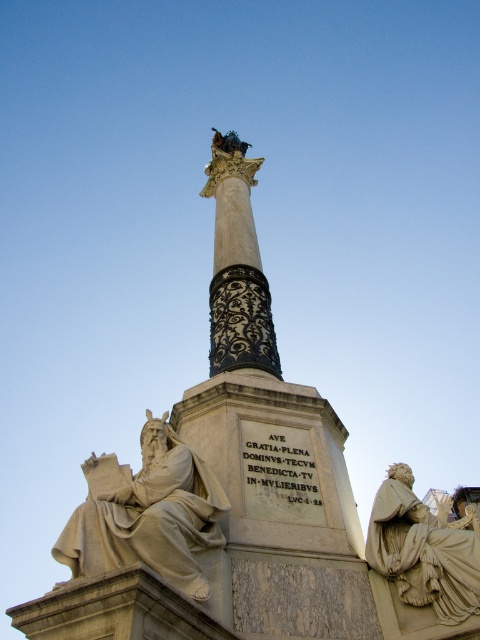
Between white marble statue at lower left and beige stone statue at lower right, which one is positioned lower?

white marble statue at lower left

Does white marble statue at lower left have a smaller size compared to beige stone statue at lower right?

Incorrect, white marble statue at lower left is not smaller in size than beige stone statue at lower right.

This screenshot has height=640, width=480. What do you see at coordinates (147, 515) in the screenshot? I see `white marble statue at lower left` at bounding box center [147, 515].

The image size is (480, 640). Find the location of `white marble statue at lower left`. white marble statue at lower left is located at coordinates (147, 515).

From the picture: Can you confirm if beige stone statue at lower right is positioned to the left of black marble column at center?

In fact, beige stone statue at lower right is to the right of black marble column at center.

Is point (371, 529) closer to camera compared to point (229, 332)?

Yes, it is in front of point (229, 332).

At what (x,y) coordinates should I click in order to perform the action: click on beige stone statue at lower right. Please return your answer as a coordinate pair (x, y). The height and width of the screenshot is (640, 480). Looking at the image, I should click on (422, 563).

Who is shorter, white marble statue at lower left or black marble column at center?

black marble column at center

Between white marble statue at lower left and black marble column at center, which one appears on the left side from the viewer's perspective?

white marble statue at lower left is more to the left.

Locate an element on the screen. This screenshot has width=480, height=640. white marble statue at lower left is located at coordinates (147, 515).